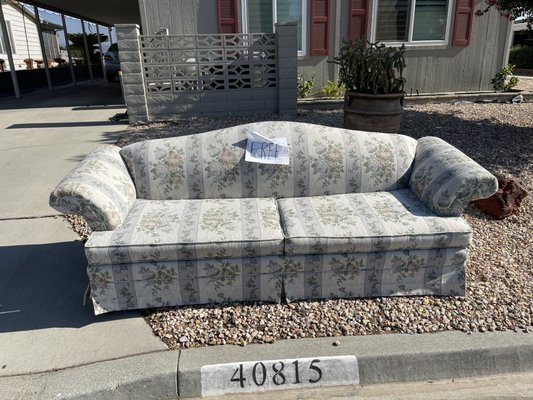
Locate an element on the screen. shutters is located at coordinates (231, 17), (314, 24), (356, 26), (456, 24).